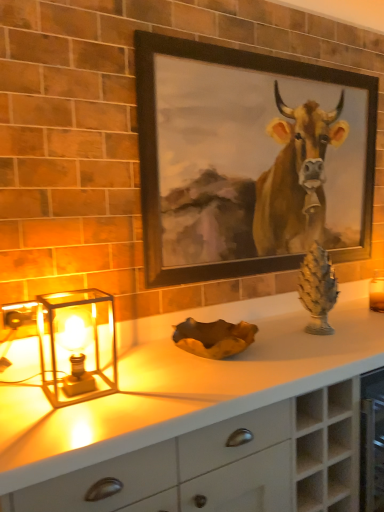
Identify the location of free spot in front of translucent glass table lamp at left. (63, 423).